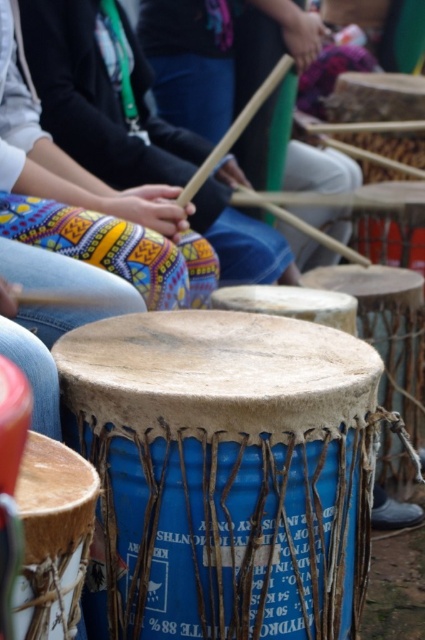
Question: Is natural leather drum at center behind natural wood drum at center?

Choices:
 (A) yes
 (B) no

Answer: (B)

Question: Estimate the real-world distances between objects in this image. Which object is farther from the patterned fabric pants at lower left?

Choices:
 (A) blue fabric drum at lower left
 (B) blue textured drum at center

Answer: (A)

Question: Can you confirm if blue fabric drum at center is positioned above blue fabric drum at lower left?

Choices:
 (A) yes
 (B) no

Answer: (B)

Question: Among these objects, which one is nearest to the camera?

Choices:
 (A) natural leather drum at center
 (B) patterned fabric pants at lower left
 (C) blue textured drum at center

Answer: (A)

Question: Can you confirm if patterned fabric pants at lower left is wider than natural wood drum at center?

Choices:
 (A) yes
 (B) no

Answer: (A)

Question: Based on their relative distances, which object is farther from the blue fabric drum at lower left?

Choices:
 (A) natural leather drum at center
 (B) blue fabric drum at center
 (C) blue textured drum at center

Answer: (C)